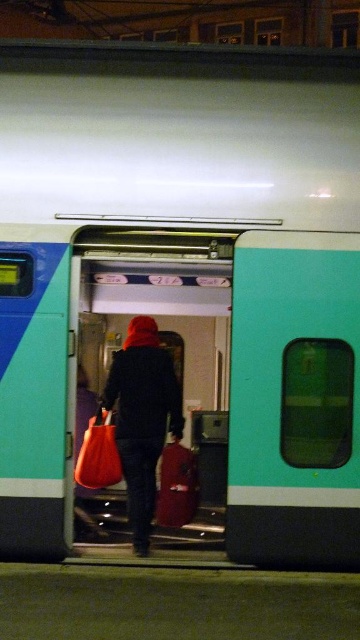
Who is more distant from viewer, (159, 451) or (99, 406)?

Positioned behind is point (99, 406).

Is dark blue fabric coat at center closer to the viewer compared to matte orange bag at center?

That is True.

What do you see at coordinates (141, 417) in the screenshot?
I see `dark blue fabric coat at center` at bounding box center [141, 417].

I want to click on dark blue fabric coat at center, so click(x=141, y=417).